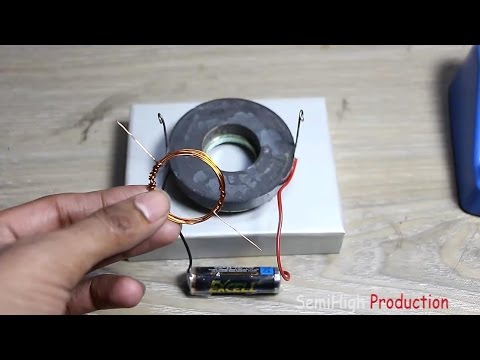
This screenshot has width=480, height=360. Identify the location of box. (473, 152).